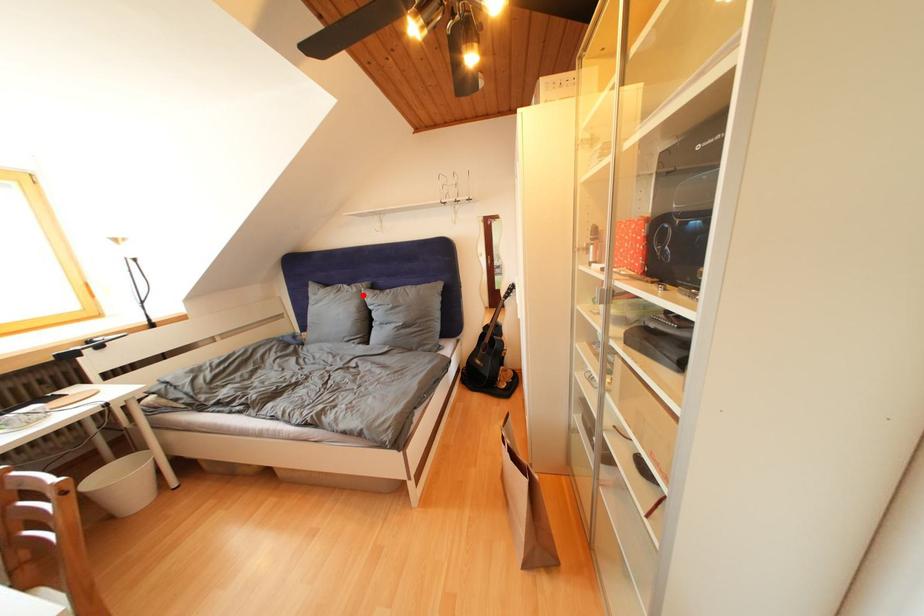
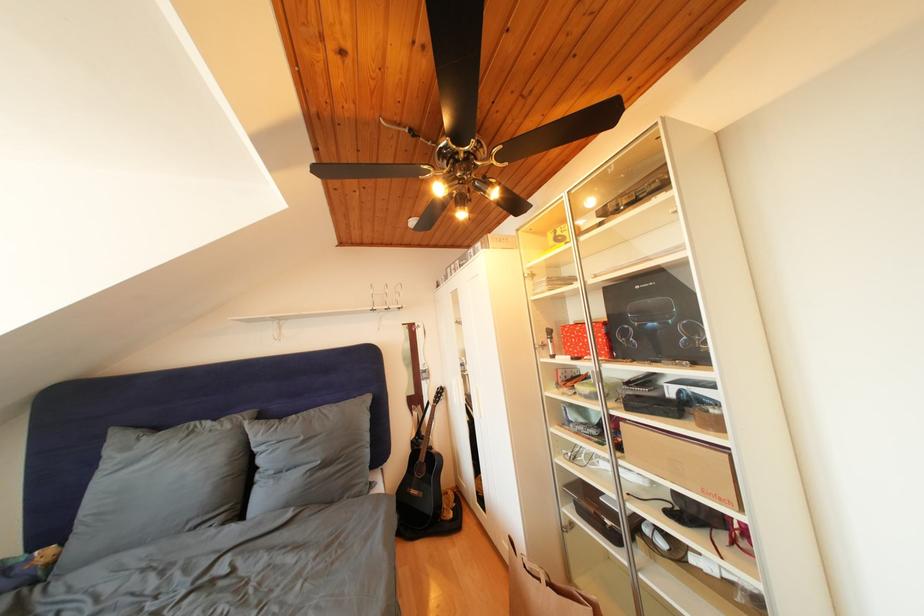
Find the pixel in the second image that matches the highlighted location in the first image.

(236, 432)